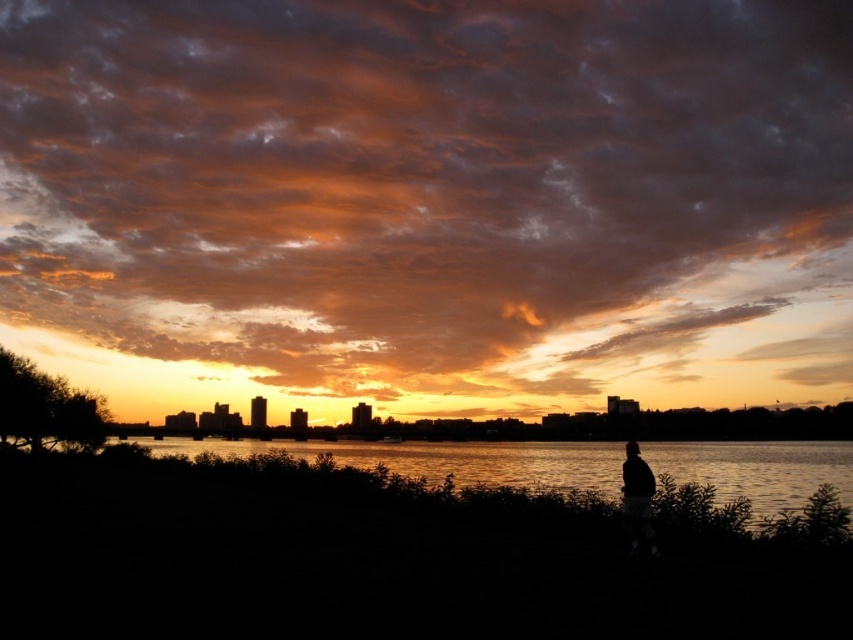
Question: Which point is closer to the camera?

Choices:
 (A) (747, 65)
 (B) (625, 529)

Answer: (B)

Question: Does orange matte cloud at upper center have a lesser width compared to black matte person at right?

Choices:
 (A) no
 (B) yes

Answer: (A)

Question: Is orange matte cloud at upper center wider than black matte person at right?

Choices:
 (A) no
 (B) yes

Answer: (B)

Question: Is orange matte cloud at upper center to the right of black matte person at right from the viewer's perspective?

Choices:
 (A) no
 (B) yes

Answer: (A)